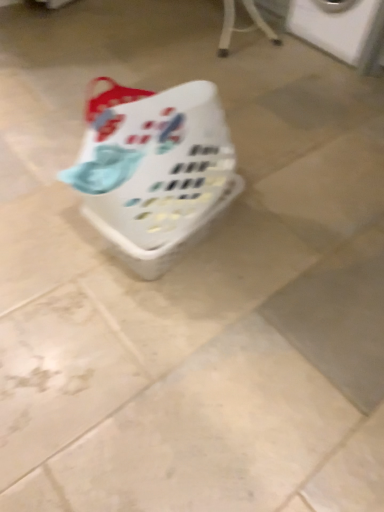
Question: From the image's perspective, is white plastic washing machine at upper right located beneath white plastic basket at center?

Choices:
 (A) yes
 (B) no

Answer: (B)

Question: Is white plastic washing machine at upper right wider than white plastic basket at center?

Choices:
 (A) no
 (B) yes

Answer: (B)

Question: Is the depth of white plastic washing machine at upper right less than that of white plastic basket at center?

Choices:
 (A) yes
 (B) no

Answer: (B)

Question: From a real-world perspective, does white plastic washing machine at upper right sit lower than white plastic basket at center?

Choices:
 (A) no
 (B) yes

Answer: (A)

Question: Is white plastic washing machine at upper right far from white plastic basket at center?

Choices:
 (A) yes
 (B) no

Answer: (A)

Question: Is white plastic washing machine at upper right at the left side of white plastic basket at center?

Choices:
 (A) yes
 (B) no

Answer: (B)

Question: Does white plastic basket at center have a smaller size compared to white plastic washing machine at upper right?

Choices:
 (A) no
 (B) yes

Answer: (B)

Question: Is the position of white plastic basket at center less distant than that of white plastic washing machine at upper right?

Choices:
 (A) yes
 (B) no

Answer: (A)

Question: Could you tell me if white plastic basket at center is facing white plastic washing machine at upper right?

Choices:
 (A) yes
 (B) no

Answer: (B)

Question: Does white plastic basket at center have a greater width compared to white plastic washing machine at upper right?

Choices:
 (A) no
 (B) yes

Answer: (A)

Question: From the image's perspective, is white plastic basket at center located above white plastic washing machine at upper right?

Choices:
 (A) yes
 (B) no

Answer: (B)

Question: Can you confirm if white plastic basket at center is shorter than white plastic washing machine at upper right?

Choices:
 (A) no
 (B) yes

Answer: (B)

Question: From their relative heights in the image, would you say white plastic washing machine at upper right is taller or shorter than white plastic basket at center?

Choices:
 (A) tall
 (B) short

Answer: (A)